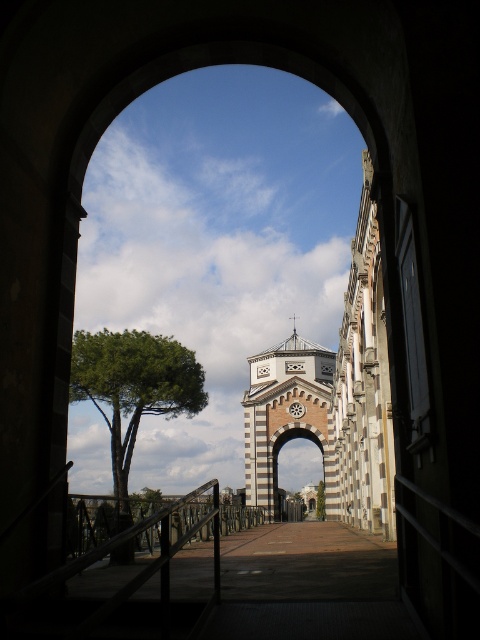
Who is positioned more to the left, matte brick archway at center or green leafy tree at center?

matte brick archway at center

Can you confirm if matte brick archway at center is smaller than green leafy tree at center?

Incorrect, matte brick archway at center is not smaller in size than green leafy tree at center.

The height and width of the screenshot is (640, 480). In order to click on matte brick archway at center in this screenshot , I will do `click(278, 451)`.

Based on the photo, does green leafy tree at left have a lesser width compared to green leafy tree at center?

No.

Is green leafy tree at left taller than green leafy tree at center?

Correct, green leafy tree at left is much taller as green leafy tree at center.

Who is more distant from viewer, (119, 360) or (323, 497)?

Point (323, 497)

The height and width of the screenshot is (640, 480). In order to click on green leafy tree at left in this screenshot , I will do `click(133, 385)`.

Based on the photo, does green leafy tree at left have a greater width compared to matte brick archway at center?

Correct, the width of green leafy tree at left exceeds that of matte brick archway at center.

Does point (110, 392) come farther from viewer compared to point (279, 449)?

No, (110, 392) is closer to viewer.

You are a GUI agent. You are given a task and a screenshot of the screen. Output one action in this format:
    pyautogui.click(x=<x>, y=<y>)
    Task: Click on the green leafy tree at left
    
    Given the screenshot: What is the action you would take?
    pyautogui.click(x=133, y=385)